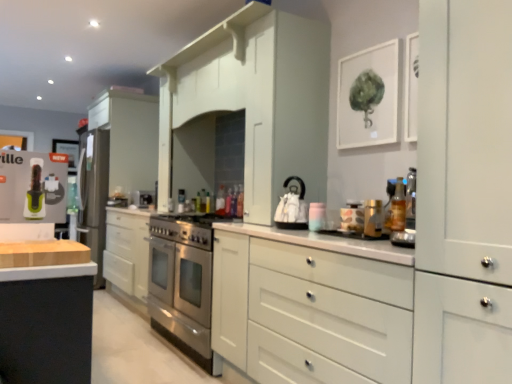
What is the approximate width of green plastic appliance at left?

green plastic appliance at left is 8.62 inches in width.

What do you see at coordinates (33, 186) in the screenshot? Image resolution: width=512 pixels, height=384 pixels. I see `green plastic appliance at left` at bounding box center [33, 186].

Locate an element on the screen. The height and width of the screenshot is (384, 512). stainless steel gas stove at center is located at coordinates (186, 228).

The height and width of the screenshot is (384, 512). Find the location of `satin silver oven at center, which is counted as the second appliance, starting from the left`. satin silver oven at center, which is counted as the second appliance, starting from the left is located at coordinates (143, 198).

Locate an element on the screen. The height and width of the screenshot is (384, 512). white glossy kettle at center, the third appliance viewed from the left is located at coordinates (292, 206).

Describe the element at coordinates (352, 217) in the screenshot. I see `matte white jar at center, the first appliance when ordered from right to left` at that location.

Where is `satin silver refrigerator at left, which is the fourth appliance in front-to-back order`? This screenshot has height=384, width=512. satin silver refrigerator at left, which is the fourth appliance in front-to-back order is located at coordinates (93, 193).

From the image's perspective, which is above, satin silver refrigerator at left, which is the fourth appliance in front-to-back order, or green plastic appliance at left?

green plastic appliance at left, from the image's perspective.

Is green plastic appliance at left at the back of satin silver refrigerator at left, the fourth appliance viewed from the right?

No, satin silver refrigerator at left, the fourth appliance viewed from the right, is not facing the opposite direction of green plastic appliance at left.

Is satin silver refrigerator at left, which is the fourth appliance in front-to-back order, taller or shorter than green plastic appliance at left?

Considering their sizes, satin silver refrigerator at left, which is the fourth appliance in front-to-back order, has more height than green plastic appliance at left.

Is white glossy kettle at center, which is counted as the 3th appliance, starting from the back, facing away from wooden at left?

That's not correct — white glossy kettle at center, which is counted as the 3th appliance, starting from the back, is not looking away from wooden at left.

Considering the positions of objects white glossy kettle at center, the third appliance viewed from the left, and wooden at left in the image provided, who is more to the right, white glossy kettle at center, the third appliance viewed from the left, or wooden at left?

white glossy kettle at center, the third appliance viewed from the left.

Is the position of white glossy kettle at center, the 2th appliance in the front-to-back sequence, less distant than that of wooden at left?

No, it is behind wooden at left.

Is white glossy kettle at center, the third appliance viewed from the left, situated inside wooden at left or outside?

white glossy kettle at center, the third appliance viewed from the left, is outside wooden at left.

Who is taller, wooden at left or satin silver oven at center, marked as the 2th appliance in a back-to-front arrangement?

Standing taller between the two is satin silver oven at center, marked as the 2th appliance in a back-to-front arrangement.

Is wooden at left facing away from satin silver oven at center, positioned as the 3th appliance in right-to-left order?

No, satin silver oven at center, positioned as the 3th appliance in right-to-left order, is not at the back of wooden at left.

Which of these two, wooden at left or satin silver oven at center, which is counted as the second appliance, starting from the left, is bigger?

With larger size is satin silver oven at center, which is counted as the second appliance, starting from the left.

Choose the correct answer: Is wooden at left inside satin silver oven at center, the third appliance viewed from the front, or outside it?

wooden at left is located beyond the bounds of satin silver oven at center, the third appliance viewed from the front.

What's the angular difference between satin silver refrigerator at left, the 1th appliance viewed from the back, and white glossy kettle at center, the third appliance viewed from the left,'s facing directions?

The angle between the facing direction of satin silver refrigerator at left, the 1th appliance viewed from the back, and the facing direction of white glossy kettle at center, the third appliance viewed from the left, is 0.375 degrees.

From a real-world perspective, is satin silver refrigerator at left, the 1th appliance viewed from the back, physically below white glossy kettle at center, the 2th appliance in the front-to-back sequence?

Yes, from a real-world perspective, satin silver refrigerator at left, the 1th appliance viewed from the back, is under white glossy kettle at center, the 2th appliance in the front-to-back sequence.

From the image's perspective, between satin silver refrigerator at left, which is counted as the 1th appliance, starting from the left, and white glossy kettle at center, which is counted as the 3th appliance, starting from the back, which one is located above?

From the image's view, white glossy kettle at center, which is counted as the 3th appliance, starting from the back, is above.

Is satin silver refrigerator at left, which is counted as the 1th appliance, starting from the left, positioned before white glossy kettle at center, the third appliance viewed from the left?

No, it is not.

Are white matte cabinet at center and green plastic appliance at left located far from each other?

white matte cabinet at center is far away from green plastic appliance at left.

Looking at their sizes, would you say white matte cabinet at center is wider or thinner than green plastic appliance at left?

A: Considering their sizes, white matte cabinet at center looks broader than green plastic appliance at left.

Is white matte cabinet at center spatially inside green plastic appliance at left, or outside of it?

The correct answer is: outside.

Who is smaller, white matte cabinet at center or green plastic appliance at left?

Smaller between the two is green plastic appliance at left.

Which is more to the right, satin silver oven at center, marked as the 2th appliance in a back-to-front arrangement, or matte white jar at center, the first appliance when ordered from right to left?

Positioned to the right is matte white jar at center, the first appliance when ordered from right to left.

Is satin silver oven at center, positioned as the 3th appliance in right-to-left order, positioned with its back to matte white jar at center, the fourth appliance when ordered from left to right?

satin silver oven at center, positioned as the 3th appliance in right-to-left order, is not turned away from matte white jar at center, the fourth appliance when ordered from left to right.

Is point (139, 198) behind point (347, 216)?

Yes, it is behind point (347, 216).

In terms of height, does white matte cabinet at center look taller or shorter compared to white glossy kettle at center, the 2th appliance in the front-to-back sequence?

white matte cabinet at center is taller than white glossy kettle at center, the 2th appliance in the front-to-back sequence.

Is white matte cabinet at center facing towards white glossy kettle at center, the 2th appliance in the front-to-back sequence?

No, white matte cabinet at center is not aimed at white glossy kettle at center, the 2th appliance in the front-to-back sequence.

Is white matte cabinet at center closer to the viewer compared to white glossy kettle at center, the third appliance viewed from the left?

Yes, it is in front of white glossy kettle at center, the third appliance viewed from the left.

Where is `refrigerator above the satin silver refrigerator at left, the 1th appliance viewed from the back (from the image's perspective)`? refrigerator above the satin silver refrigerator at left, the 1th appliance viewed from the back (from the image's perspective) is located at coordinates (33, 186).

Locate an element on the screen. The width and height of the screenshot is (512, 384). countertop in front of the white glossy kettle at center, which is counted as the 3th appliance, starting from the back is located at coordinates (44, 260).

Based on their spatial positions, is white glossy kettle at center, the 2th appliance in the right-to-left sequence, or green plastic appliance at left closer to wooden at left?

green plastic appliance at left is closer to wooden at left.

Which object lies further to the anchor point stainless steel gas stove at center, matte white jar at center, the fourth appliance viewed from the back, or satin silver refrigerator at left, the 1th appliance viewed from the back?

Among the two, satin silver refrigerator at left, the 1th appliance viewed from the back, is located further to stainless steel gas stove at center.

From the image, which object appears to be farther from wooden at left, green plastic appliance at left or white glossy kettle at center, the 2th appliance in the front-to-back sequence?

white glossy kettle at center, the 2th appliance in the front-to-back sequence.

Consider the image. Estimate the real-world distances between objects in this image. Which object is closer to wooden at left, stainless steel gas stove at center or satin silver oven at center, positioned as the 3th appliance in right-to-left order?

stainless steel gas stove at center is closer to wooden at left.

Looking at the image, which one is located closer to stainless steel gas stove at center, satin silver oven at center, which is counted as the second appliance, starting from the left, or satin silver refrigerator at left, which is counted as the 1th appliance, starting from the left?

satin silver oven at center, which is counted as the second appliance, starting from the left.

From the image, which object appears to be nearer to stainless steel gas stove at center, satin silver refrigerator at left, the fourth appliance viewed from the right, or satin silver oven at center, positioned as the 3th appliance in right-to-left order?

satin silver oven at center, positioned as the 3th appliance in right-to-left order.

Which object lies nearer to the anchor point white matte cabinet at center, white glossy kettle at center, which is counted as the 3th appliance, starting from the back, or satin silver refrigerator at left, which is counted as the 1th appliance, starting from the left?

white glossy kettle at center, which is counted as the 3th appliance, starting from the back, is closer to white matte cabinet at center.

From the image, which object appears to be farther from satin silver oven at center, which is counted as the second appliance, starting from the left, green plastic appliance at left or white matte cabinet at center?

Among the two, green plastic appliance at left is located further to satin silver oven at center, which is counted as the second appliance, starting from the left.

Find the location of a particular element. The width and height of the screenshot is (512, 384). appliance between white matte cabinet at center and white glossy kettle at center, the 2th appliance in the front-to-back sequence, from front to back is located at coordinates (352, 217).

Identify the location of appliance situated between green plastic appliance at left and white matte cabinet at center from left to right. (292, 206).

Find the location of a particular element. Image resolution: width=512 pixels, height=384 pixels. gas stove between green plastic appliance at left and satin silver refrigerator at left, which is the fourth appliance in front-to-back order, in the front-back direction is located at coordinates (186, 228).

Find the location of a particular element. gas stove between green plastic appliance at left and matte white jar at center, the first appliance when ordered from right to left, in the horizontal direction is located at coordinates (186, 228).